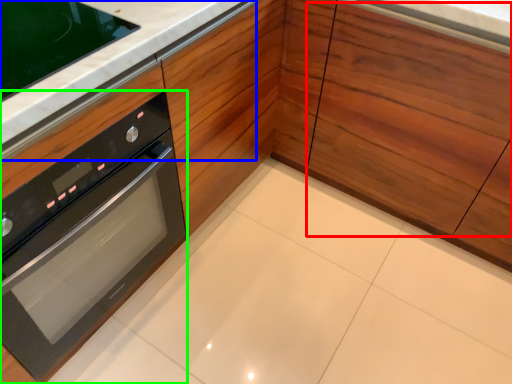
Question: Estimate the real-world distances between objects in this image. Which object is farther from drawer (highlighted by a red box), counter top (highlighted by a blue box) or oven (highlighted by a green box)?

Choices:
 (A) counter top
 (B) oven

Answer: (B)